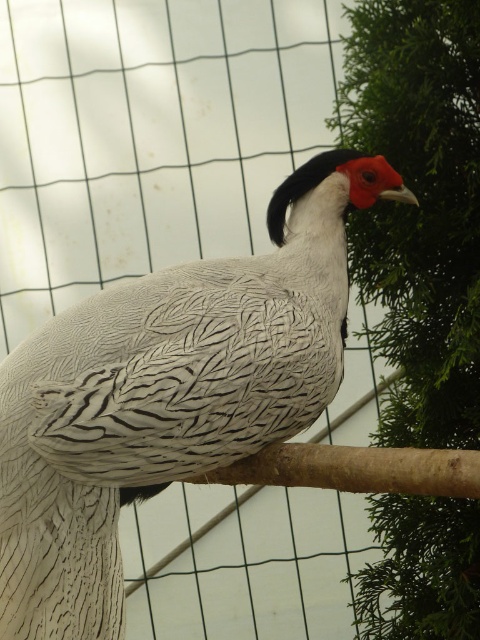
Looking at this image, you are standing in front of the enclosure and want to take a photo of the bird. The bird is currently at point (304, 228). If your camera can focus up to 5 feet away, will you be able to capture a clear image of the bird at that point?

The distance of point (304, 228) from the viewer is 4.84 feet, which is within the camera focus range of up to 5 feet. Therefore, you can capture a clear image of the bird at that point.

You are standing in front of a bird enclosure and want to take a photo of the white feathered bird at center. If the camera has a focal length of 50mm and you are positioned at point 0.5, 0.5, will the bird be in the center of your photo?

The white feathered bird at center is located at point (x=168, y=394), which is slightly to the right and below the center point (x=240, y=320). Therefore, the bird will not be perfectly centered in the photo.